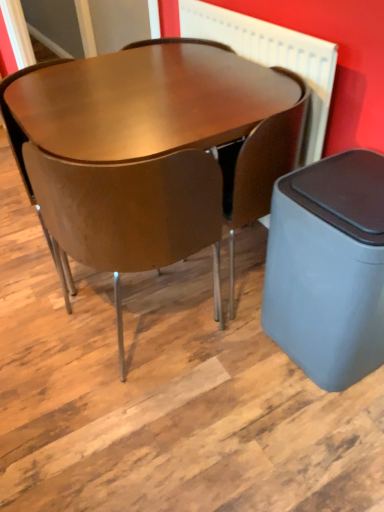
Question: Would you say matte brown chair at center, the second chair positioned from the right, contains glossy wood table at center?

Choices:
 (A) no
 (B) yes

Answer: (A)

Question: Considering the relative positions of matte brown chair at center, the second chair positioned from the right, and glossy wood table at center in the image provided, is matte brown chair at center, the second chair positioned from the right, to the right of glossy wood table at center from the viewer's perspective?

Choices:
 (A) yes
 (B) no

Answer: (B)

Question: From a real-world perspective, does matte brown chair at center, the second chair positioned from the right, sit lower than glossy wood table at center?

Choices:
 (A) no
 (B) yes

Answer: (A)

Question: Considering the relative sizes of matte brown chair at center, the second chair positioned from the right, and glossy wood table at center in the image provided, is matte brown chair at center, the second chair positioned from the right, taller than glossy wood table at center?

Choices:
 (A) no
 (B) yes

Answer: (B)

Question: From the image's perspective, is matte brown chair at center, the second chair positioned from the right, over glossy wood table at center?

Choices:
 (A) no
 (B) yes

Answer: (A)

Question: In the image, is glossy wood table at center positioned in front of or behind gray matte waste bin at lower right?

Choices:
 (A) front
 (B) behind

Answer: (B)

Question: From a real-world perspective, is glossy wood table at center positioned above or below gray matte waste bin at lower right?

Choices:
 (A) below
 (B) above

Answer: (B)

Question: Does point (238, 68) appear closer or farther from the camera than point (302, 292)?

Choices:
 (A) farther
 (B) closer

Answer: (A)

Question: Is glossy wood table at center wider or thinner than gray matte waste bin at lower right?

Choices:
 (A) thin
 (B) wide

Answer: (B)

Question: Choose the correct answer: Is gray matte waste bin at lower right inside matte brown chair at center, which ranks as the 1th chair in right-to-left order, or outside it?

Choices:
 (A) inside
 (B) outside

Answer: (B)

Question: From the image's perspective, is gray matte waste bin at lower right above or below matte brown chair at center, the second chair when ordered from left to right?

Choices:
 (A) above
 (B) below

Answer: (B)

Question: From a real-world perspective, is gray matte waste bin at lower right positioned above or below matte brown chair at center, the second chair when ordered from left to right?

Choices:
 (A) below
 (B) above

Answer: (A)

Question: Considering their positions, is gray matte waste bin at lower right located in front of or behind matte brown chair at center, which ranks as the 1th chair in right-to-left order?

Choices:
 (A) behind
 (B) front

Answer: (B)

Question: Which is correct: matte brown chair at center, which ranks as the 1th chair in right-to-left order, is inside glossy wood table at center, or outside of it?

Choices:
 (A) outside
 (B) inside

Answer: (B)

Question: From a real-world perspective, is matte brown chair at center, which ranks as the 1th chair in right-to-left order, above or below glossy wood table at center?

Choices:
 (A) above
 (B) below

Answer: (A)